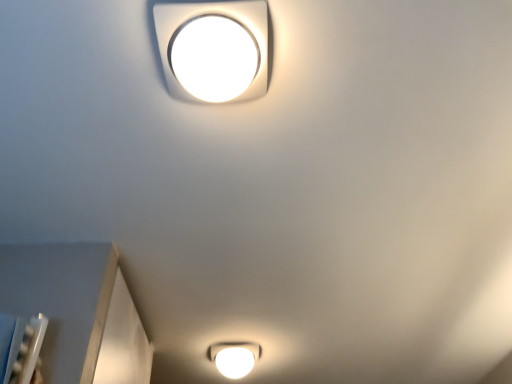
Question: Is white glossy square lamp at upper center, the 1th lamp viewed from the top, wider or thinner than white glossy light fixture at bottom, which is the 2th lamp from front to back?

Choices:
 (A) wide
 (B) thin

Answer: (B)

Question: Is white glossy square lamp at upper center, the first lamp when ordered from front to back, bigger or smaller than white glossy light fixture at bottom, placed as the 1th lamp when sorted from back to front?

Choices:
 (A) small
 (B) big

Answer: (A)

Question: Is white glossy square lamp at upper center, the second lamp when ordered from back to front, inside the boundaries of white glossy light fixture at bottom, which is the first lamp from bottom to top, or outside?

Choices:
 (A) inside
 (B) outside

Answer: (B)

Question: In terms of height, does white glossy light fixture at bottom, which is the first lamp from bottom to top, look taller or shorter compared to white glossy square lamp at upper center, the first lamp when ordered from front to back?

Choices:
 (A) short
 (B) tall

Answer: (B)

Question: Which is correct: white glossy light fixture at bottom, which is the 2th lamp from front to back, is inside white glossy square lamp at upper center, the second lamp when ordered from back to front, or outside of it?

Choices:
 (A) inside
 (B) outside

Answer: (B)

Question: Considering their positions, is white glossy light fixture at bottom, which is the first lamp from bottom to top, located in front of or behind white glossy square lamp at upper center, the first lamp when ordered from front to back?

Choices:
 (A) front
 (B) behind

Answer: (B)

Question: From a real-world perspective, relative to white glossy square lamp at upper center, the 1th lamp viewed from the top, is white glossy light fixture at bottom, which is the first lamp from bottom to top, vertically above or below?

Choices:
 (A) above
 (B) below

Answer: (A)